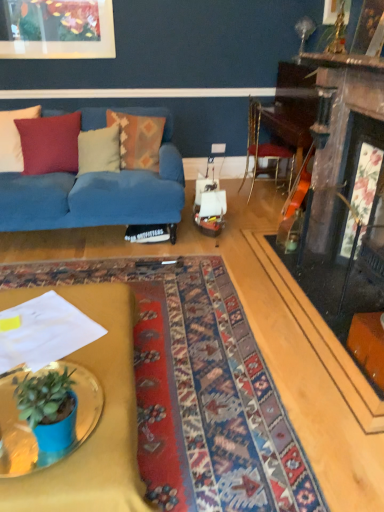
Question: Is blue fabric couch at left bigger or smaller than metallic gold chair at center-right?

Choices:
 (A) big
 (B) small

Answer: (A)

Question: From the image's perspective, relative to metallic gold chair at center-right, is blue fabric couch at left above or below?

Choices:
 (A) above
 (B) below

Answer: (B)

Question: Considering the real-world distances, which object is farthest from the textured woolen pillow at left, positioned as the third pillow in right-to-left order?

Choices:
 (A) carpeted rug at center
 (B) soft cotton pillow at center, the third pillow from the left
 (C) white cotton pillow at left, which appears as the 1th pillow when viewed from the left
 (D) textured orange pillow at center, the first pillow positioned from the right
 (E) blue fabric couch at left

Answer: (A)

Question: Considering the real-world distances, which object is farthest from the metallic gold desk at center?

Choices:
 (A) metallic gold chair at center-right
 (B) carpeted rug at center
 (C) white cotton pillow at left, which appears as the 1th pillow when viewed from the left
 (D) blue glossy table at lower left
 (E) textured woolen pillow at left, positioned as the third pillow in right-to-left order

Answer: (A)